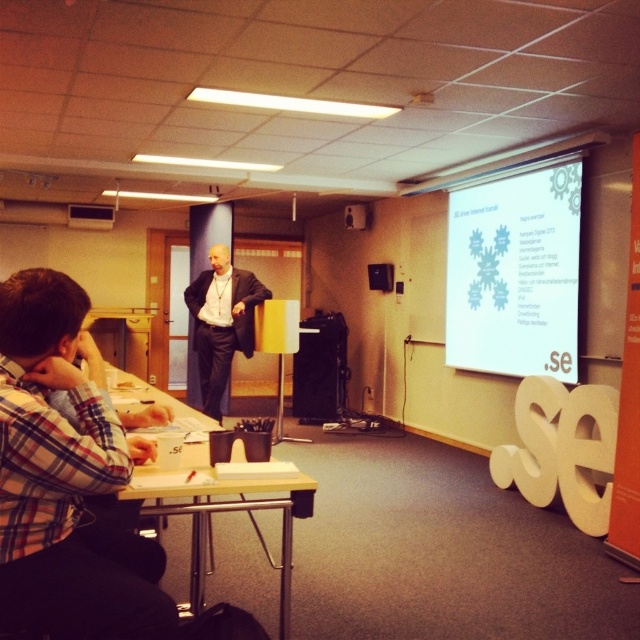
Is plaid shirt at lower left further to camera compared to white matte projection screen at upper right?

No, plaid shirt at lower left is closer to the viewer.

Who is shorter, plaid shirt at lower left or white matte projection screen at upper right?

plaid shirt at lower left

Describe the element at coordinates (65, 481) in the screenshot. I see `plaid shirt at lower left` at that location.

Locate an element on the screen. plaid shirt at lower left is located at coordinates (65, 481).

Measure the distance between plaid shirt at lower left and camera.

The distance of plaid shirt at lower left from camera is 4.43 feet.

Can you confirm if plaid shirt at lower left is positioned below black plastic projector at upper center?

Yes.

I want to click on plaid shirt at lower left, so click(x=65, y=481).

Who is higher up, plaid shirt at lower left or wooden table at lower left?

Positioned higher is plaid shirt at lower left.

Is point (58, 472) more distant than point (198, 600)?

No, it is in front of (198, 600).

Where is `plaid shirt at lower left`? plaid shirt at lower left is located at coordinates (65, 481).